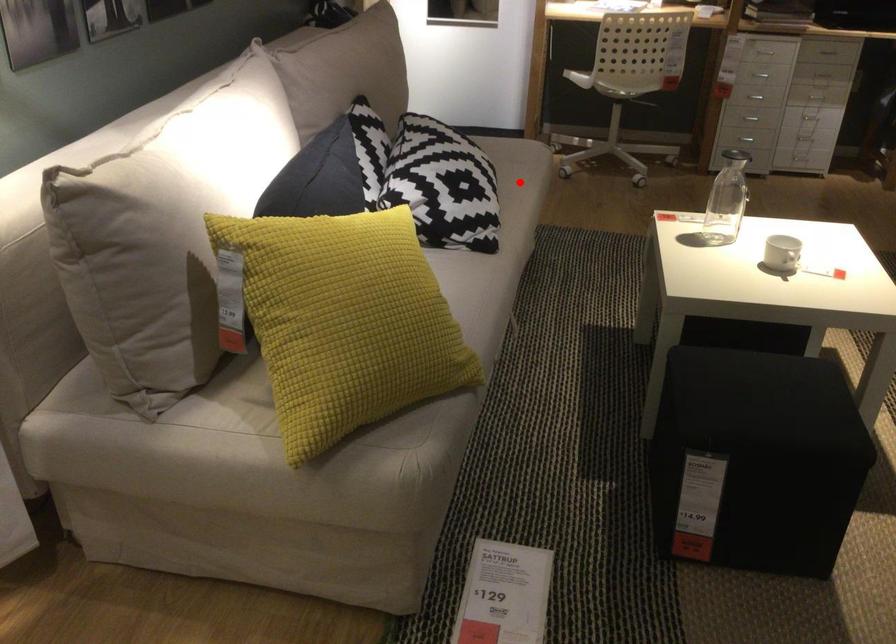
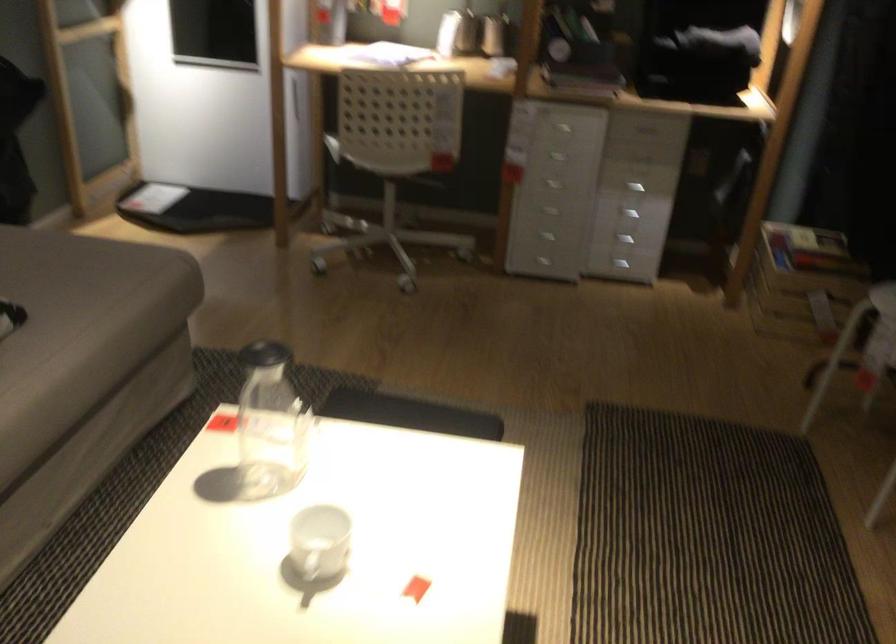
Question: I am providing you with two images of the same scene from different viewpoints. In image1, a red point is highlighted. Considering the same 3D point in image2, which of the following is correct?

Choices:
 (A) It is closer
 (B) It is farther

Answer: (A)